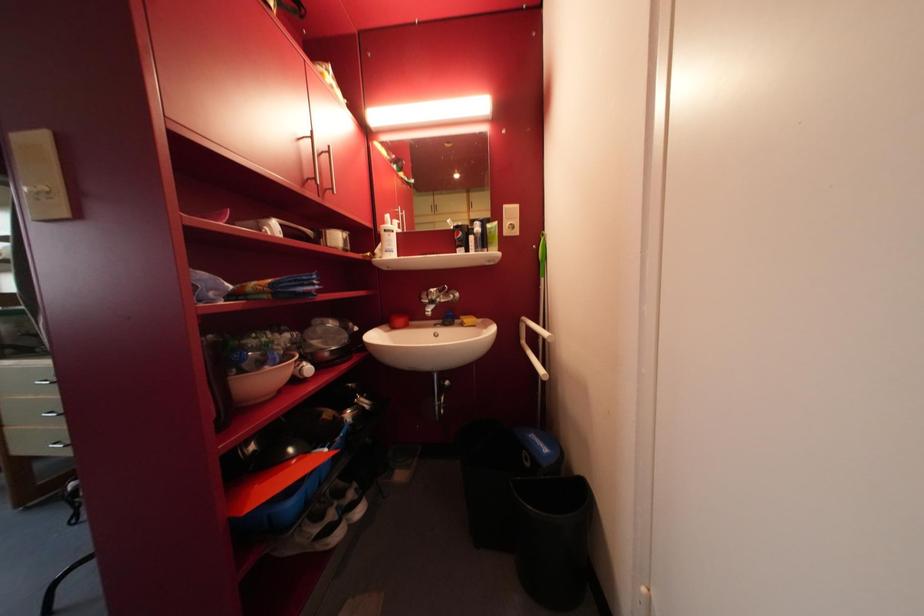
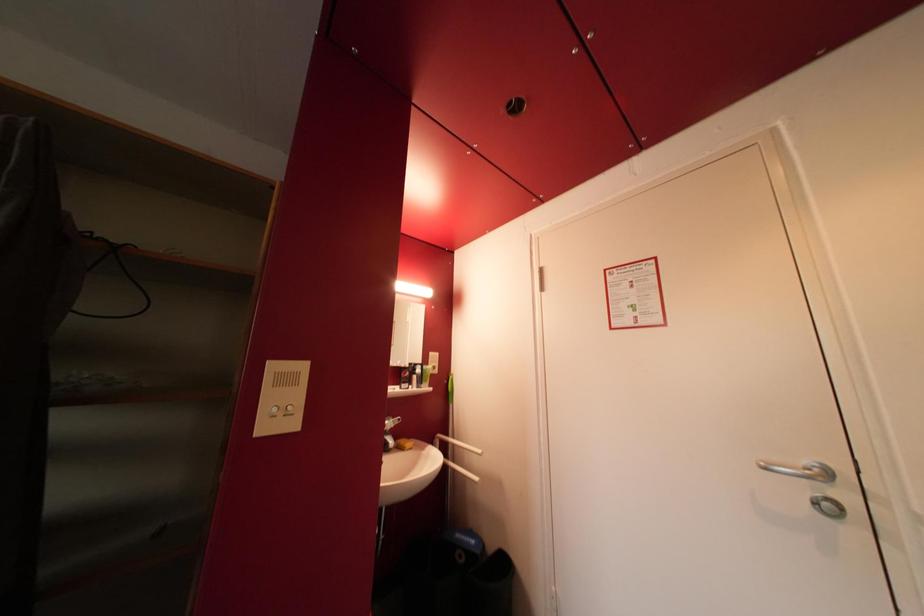
How did the camera likely rotate?

The camera rotated toward right-up.